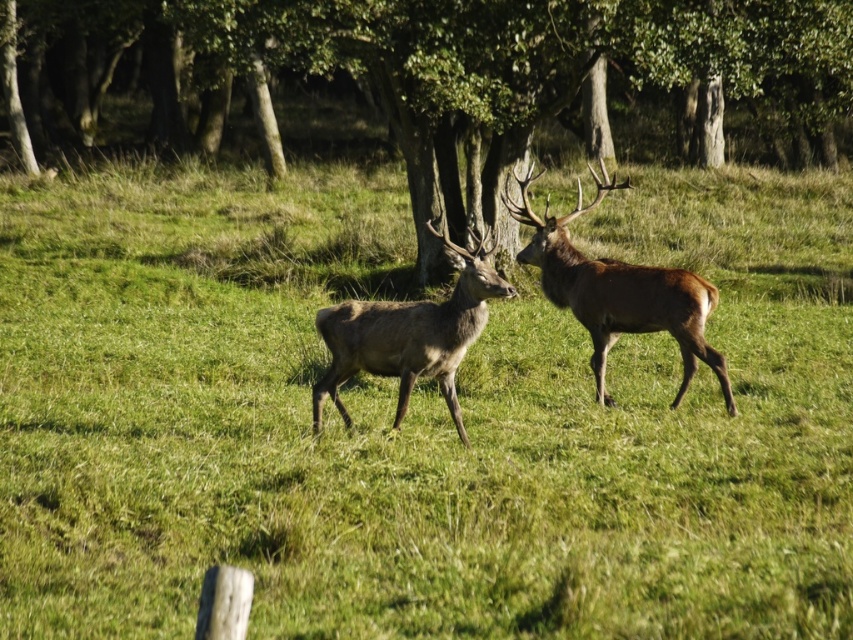
Is green leafy tree at center above brown velvet deer at center?

Yes.

Does green leafy tree at center appear on the right side of brown velvet deer at center?

In fact, green leafy tree at center is to the left of brown velvet deer at center.

You are a GUI agent. You are given a task and a screenshot of the screen. Output one action in this format:
    pyautogui.click(x=<x>, y=<y>)
    Task: Click on the green leafy tree at center
    This screenshot has width=853, height=640.
    Given the screenshot: What is the action you would take?
    pyautogui.click(x=438, y=72)

Where is `green leafy tree at center`? The height and width of the screenshot is (640, 853). green leafy tree at center is located at coordinates pyautogui.click(x=438, y=72).

Is point (68, 84) farther from viewer compared to point (363, 340)?

Yes, it is behind point (363, 340).

Between green leafy tree at center and brown matte/deer at center, which one appears on the left side from the viewer's perspective?

green leafy tree at center is more to the left.

Who is more distant from viewer, (509, 93) or (480, 289)?

Point (509, 93)

This screenshot has height=640, width=853. Identify the location of green leafy tree at center. (438, 72).

Which of these two, brown velvet deer at center or brown matte/deer at center, stands taller?

Standing taller between the two is brown velvet deer at center.

Where is `brown velvet deer at center`? This screenshot has height=640, width=853. brown velvet deer at center is located at coordinates (618, 291).

The image size is (853, 640). What are the coordinates of `brown velvet deer at center` in the screenshot? It's located at (618, 291).

This screenshot has height=640, width=853. I want to click on brown velvet deer at center, so click(618, 291).